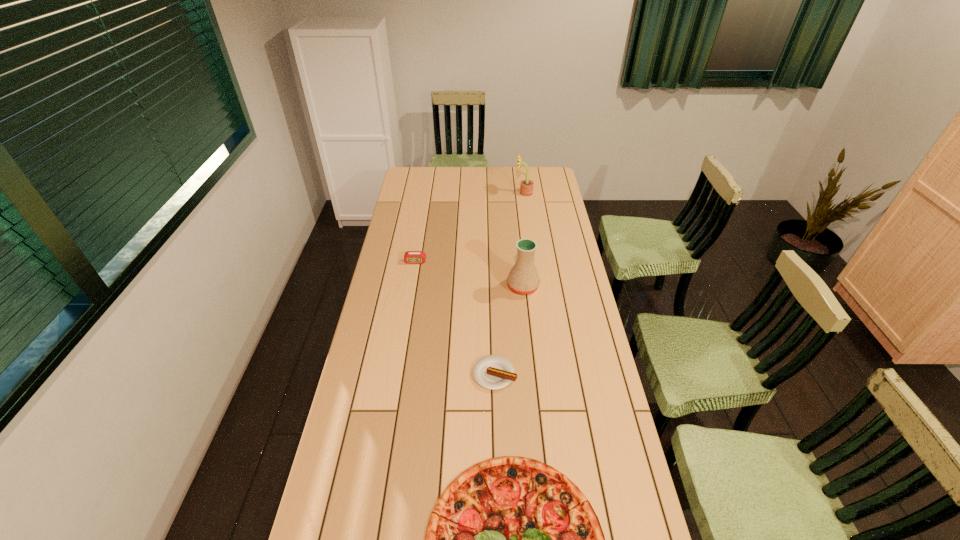
Locate an element on the screen. This screenshot has height=540, width=960. vacant space that is in between the pottery and the second nearest object is located at coordinates (509, 330).

Locate an element on the screen. free space between the leftmost object and the sausage is located at coordinates (455, 318).

Find the location of a particular element. vacant area that lies between the second nearest object and the pottery is located at coordinates [509, 330].

At what (x,y) coordinates should I click in order to perform the action: click on vacant region between the alarm clock and the farthest object. Please return your answer as a coordinate pair (x, y). Looking at the image, I should click on (469, 227).

At what (x,y) coordinates should I click in order to perform the action: click on vacant area that lies between the sunflower and the third tallest object. Please return your answer as a coordinate pair (x, y). Looking at the image, I should click on (469, 227).

Where is `object that is the fourth closest one to the third shortest object`? object that is the fourth closest one to the third shortest object is located at coordinates point(511,539).

Identify which object is the fourth nearest to the leftmost object. Please provide its 2D coordinates. Your answer should be formatted as a tuple, i.e. [(x, y)], where the tuple contains the x and y coordinates of a point satisfying the conditions above.

[(511, 539)]

The width and height of the screenshot is (960, 540). What are the coordinates of `vacant space that satisfies the following two spatial constraints: 1. on the front-facing side of the alarm clock; 2. on the right side of the fourth farthest object` in the screenshot? It's located at coord(396,374).

This screenshot has height=540, width=960. I want to click on vacant space that satisfies the following two spatial constraints: 1. on the back side of the third nearest object; 2. on the left side of the second nearest object, so click(x=492, y=287).

Find the location of a particular element. The image size is (960, 540). vacant space that satisfies the following two spatial constraints: 1. on the front-facing side of the second shortest object; 2. on the left side of the third tallest object is located at coordinates (396, 374).